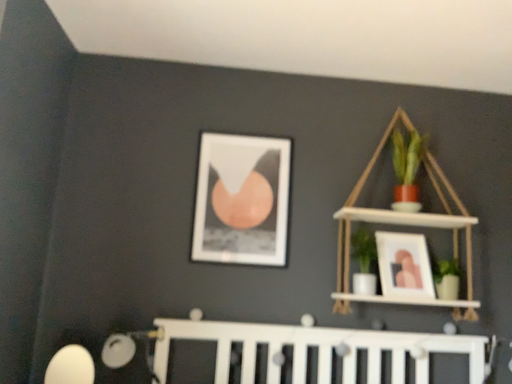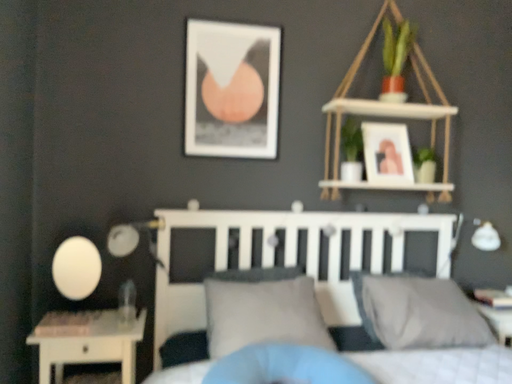
Question: Which way did the camera rotate in the video?

Choices:
 (A) rotated right
 (B) rotated left

Answer: (A)